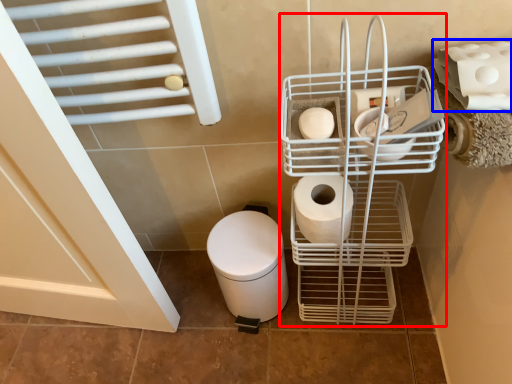
Question: Which object appears closest to the camera in this image, shopping cart (highlighted by a red box) or toilet paper (highlighted by a blue box)?

Choices:
 (A) shopping cart
 (B) toilet paper

Answer: (A)